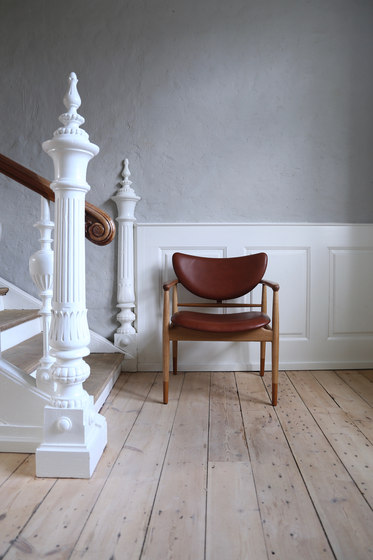
Find the location of a particular element. Image resolution: width=373 pixels, height=560 pixels. chair back is located at coordinates click(x=228, y=270).